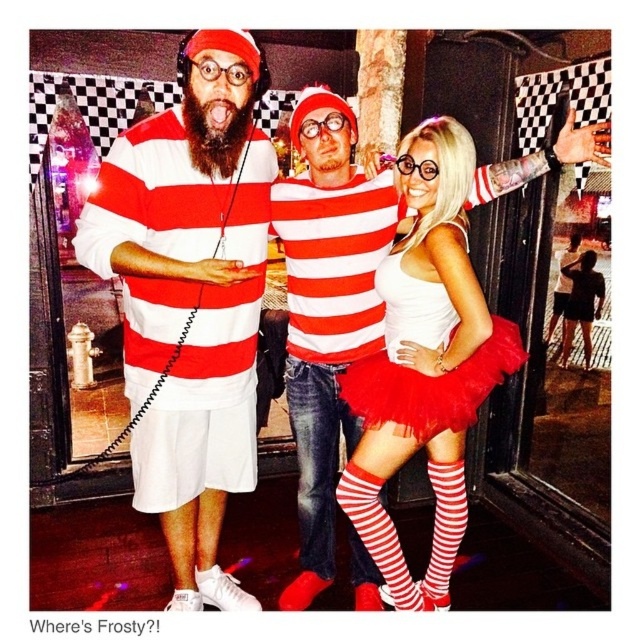
Question: Can you confirm if matte white shorts at center is positioned below white tulle skirt at center?

Choices:
 (A) no
 (B) yes

Answer: (A)

Question: From the image, what is the correct spatial relationship of white tulle skirt at center in relation to red tulle skirt at center?

Choices:
 (A) below
 (B) above

Answer: (A)

Question: Which object appears farthest from the camera in this image?

Choices:
 (A) red tulle skirt at center
 (B) matte white shorts at center
 (C) white tulle skirt at center

Answer: (A)

Question: Considering the relative positions of matte white shorts at center and white tulle skirt at center in the image provided, where is matte white shorts at center located with respect to white tulle skirt at center?

Choices:
 (A) below
 (B) above

Answer: (B)

Question: Which of the following is the closest to the observer?

Choices:
 (A) red tulle skirt at center
 (B) matte white shorts at center
 (C) white tulle skirt at center

Answer: (B)

Question: Which point is closer to the camera?

Choices:
 (A) red tulle skirt at center
 (B) white tulle skirt at center
 (C) matte white shorts at center

Answer: (C)